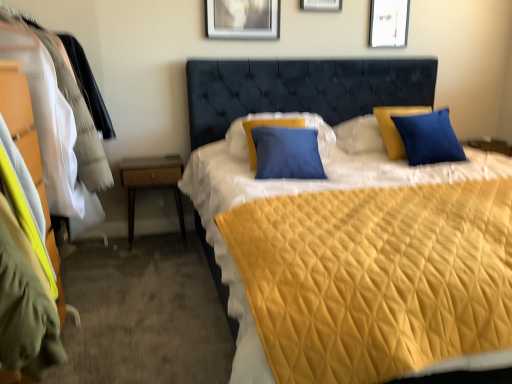
The height and width of the screenshot is (384, 512). Find the location of `vacant space underneath wooden nightstand at lower left (from a real-world perspective)`. vacant space underneath wooden nightstand at lower left (from a real-world perspective) is located at coordinates (158, 238).